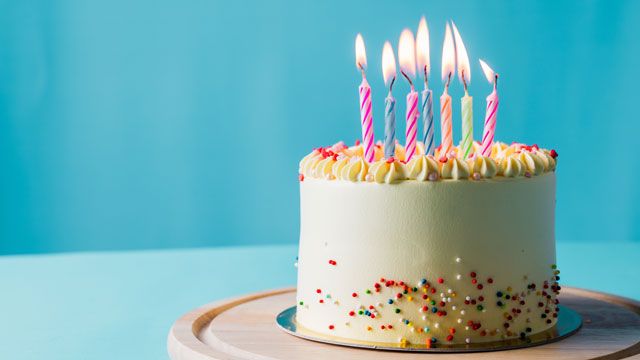
The image size is (640, 360). Find the location of `birthday candles`. birthday candles is located at coordinates point(491,112), point(468,117), point(445,121), point(426,111), point(410,116), point(388,117), point(365,116).